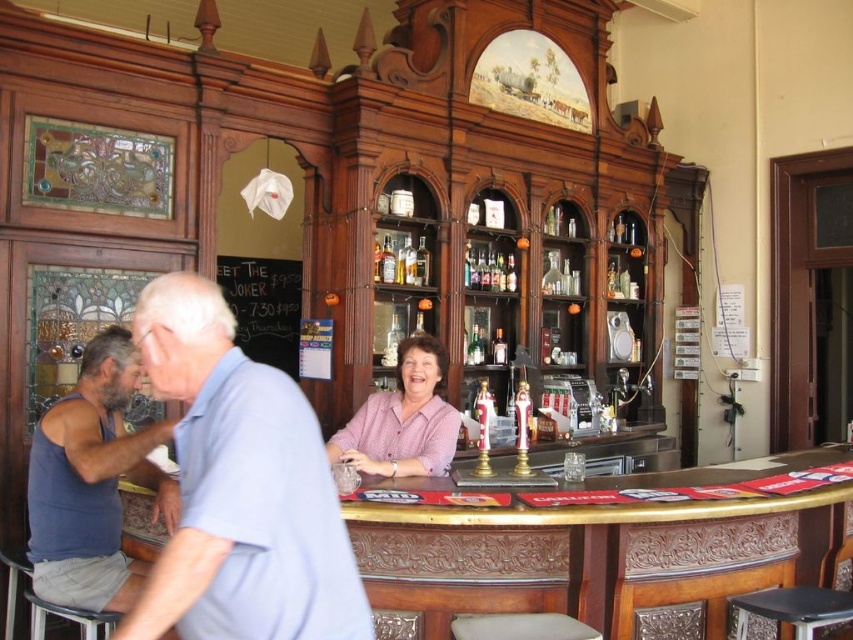
Does light blue cotton shirt at center have a smaller size compared to black leather bar stool at lower right?

No.

Which is in front, point (177, 433) or point (799, 588)?

Point (177, 433)

Locate an element on the screen. light blue cotton shirt at center is located at coordinates (241, 488).

Where is `light blue cotton shirt at center`? Image resolution: width=853 pixels, height=640 pixels. light blue cotton shirt at center is located at coordinates (241, 488).

From the picture: Which is more to the left, blue fabric tank top at lower left or translucent glass bottle at center?

blue fabric tank top at lower left

Is blue fabric tank top at lower left positioned before translucent glass bottle at center?

Yes, it is.

At what (x,y) coordinates should I click in order to perform the action: click on blue fabric tank top at lower left. Please return your answer as a coordinate pair (x, y). Looking at the image, I should click on (91, 483).

This screenshot has width=853, height=640. In order to click on blue fabric tank top at lower left in this screenshot , I will do `click(91, 483)`.

How far apart are blue fabric tank top at lower left and pink woven blouse at center?

blue fabric tank top at lower left is 94.56 centimeters from pink woven blouse at center.

Does point (56, 552) come in front of point (354, 422)?

Yes, it is in front of point (354, 422).

Who is more distant from viewer, [91,349] or [341,440]?

The point [341,440] is behind.

Identify the location of blue fabric tank top at lower left. The image size is (853, 640). (91, 483).